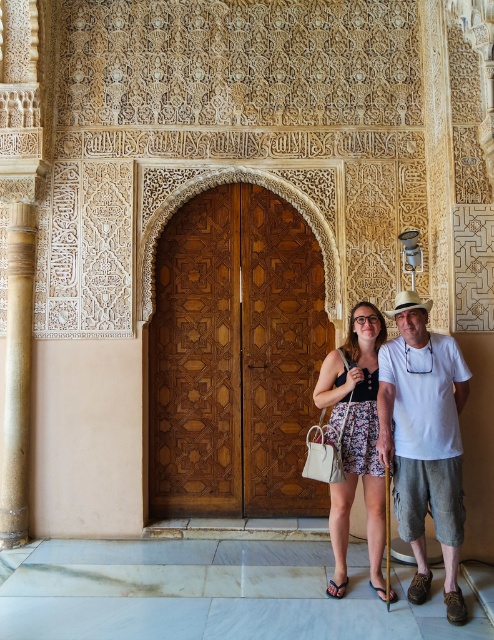
You are standing in a historical building with ornate doors and want to pick up your brown leather sandal at lower center. Can you reach it without opening the wooden carved door at center?

The brown leather sandal at lower center is behind the wooden carved door at center, so you cannot reach it without opening the door.

You are an architect designing a replica of this building. You need to place a new door in the exact same position as the wooden carved door at center. What are the coordinates where you should place the new door?

The wooden carved door at center should be placed at coordinates point (235, 356).